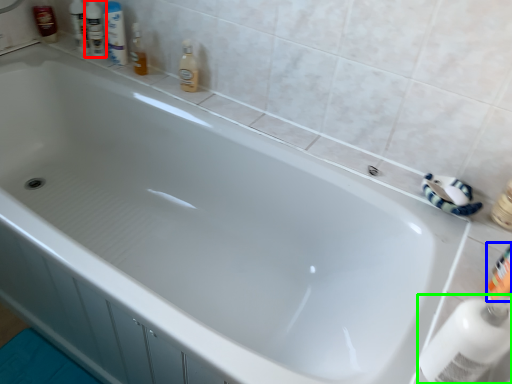
Question: Considering the real-world distances, which object is farthest from toiletry (highlighted by a red box)? toiletry (highlighted by a blue box) or cleaning product (highlighted by a green box)?

Choices:
 (A) toiletry
 (B) cleaning product

Answer: (B)